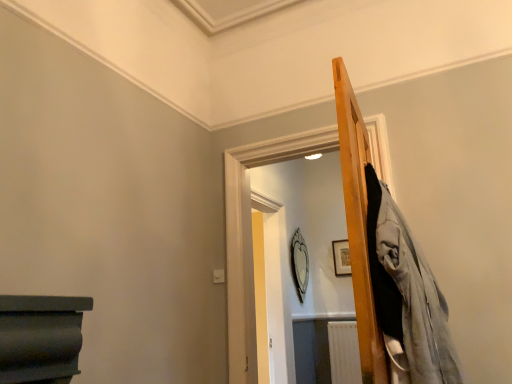
Question: Considering the positions of silver metallic mirror at center and wooden picture frame at upper right in the image, is silver metallic mirror at center bigger or smaller than wooden picture frame at upper right?

Choices:
 (A) small
 (B) big

Answer: (B)

Question: Considering their positions, is silver metallic mirror at center located in front of or behind wooden picture frame at upper right?

Choices:
 (A) front
 (B) behind

Answer: (A)

Question: Considering the positions of silver metallic mirror at center and wooden picture frame at upper right in the image, is silver metallic mirror at center wider or thinner than wooden picture frame at upper right?

Choices:
 (A) thin
 (B) wide

Answer: (B)

Question: Do you think wooden picture frame at upper right is within silver metallic mirror at center, or outside of it?

Choices:
 (A) outside
 (B) inside

Answer: (A)

Question: Is point tap(347, 274) closer or farther from the camera than point tap(289, 253)?

Choices:
 (A) farther
 (B) closer

Answer: (A)

Question: Visually, is wooden picture frame at upper right positioned to the left or to the right of silver metallic mirror at center?

Choices:
 (A) right
 (B) left

Answer: (A)

Question: Is wooden picture frame at upper right bigger or smaller than silver metallic mirror at center?

Choices:
 (A) big
 (B) small

Answer: (B)